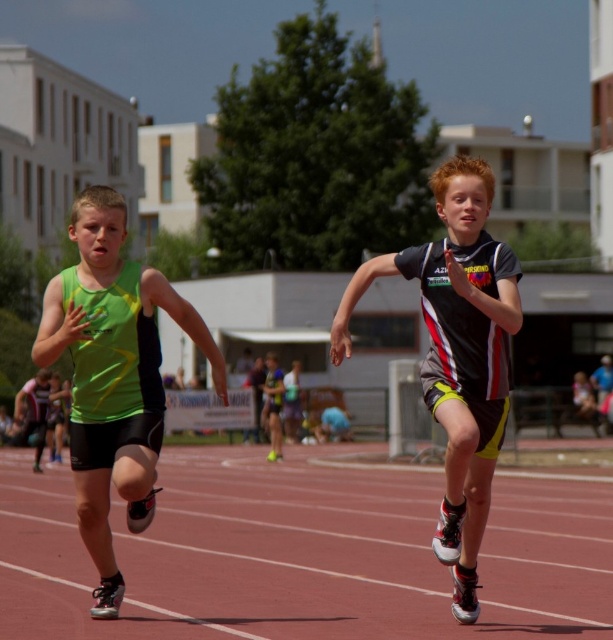
Find the location of a particular element. This screenshot has height=640, width=613. rubberized red track at center is located at coordinates point(303,554).

Does rubberized red track at center appear over black and white jersey at center?

No, rubberized red track at center is not above black and white jersey at center.

Is point (86, 572) farther from camera compared to point (351, 296)?

Yes, point (86, 572) is behind point (351, 296).

Find the location of a particular element. This screenshot has width=613, height=640. rubberized red track at center is located at coordinates (303, 554).

Does rubberized red track at center appear on the left side of green matte tank top at left?

In fact, rubberized red track at center is to the right of green matte tank top at left.

Is rubberized red track at center below green matte tank top at left?

Correct, rubberized red track at center is located below green matte tank top at left.

Identify the location of rubberized red track at center. (303, 554).

Identify the location of rubberized red track at center. The height and width of the screenshot is (640, 613). (303, 554).

Which is below, green matte tank top at left or black and white jersey at center?

black and white jersey at center

In the scene shown: Is green matte tank top at left bigger than black and white jersey at center?

No.

Between point (113, 328) and point (468, 445), which one is positioned behind?

The point (113, 328) is behind.

The height and width of the screenshot is (640, 613). What are the coordinates of `green matte tank top at left` in the screenshot? It's located at (113, 376).